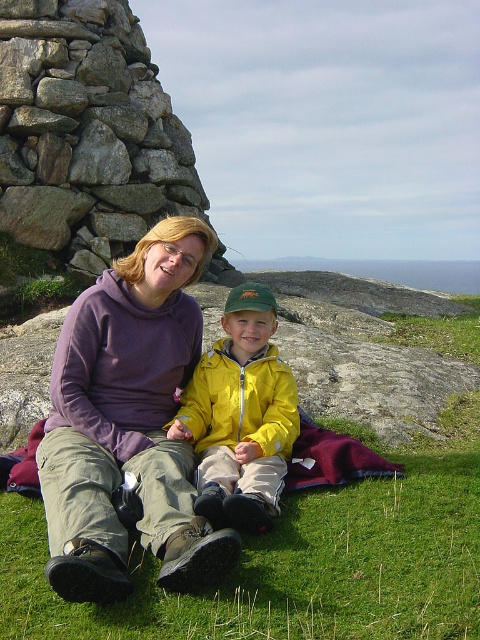
You are standing at the point labeled point (6, 116) and want to walk to the point labeled point (153, 369). Which direction should you face to walk towards your destination?

You should face forward because point (153, 369) is in front of point (6, 116).

You are standing in the outdoor scene and want to take a photo of the rustic stone cairn at left and the yellow matte jacket at center. Which object should you position closer to the left side of your camera frame?

The rustic stone cairn at left should be positioned closer to the left side of your camera frame because it is located to the left of the yellow matte jacket at center.